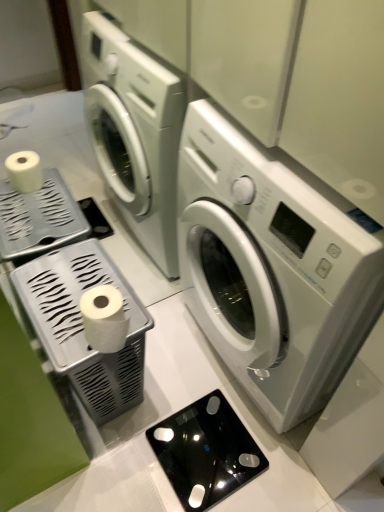
You are a GUI agent. You are given a task and a screenshot of the screen. Output one action in this format:
    pyautogui.click(x=<x>, y=<y>)
    Task: Click on the vacant area that is situated to the right of black glass scale at lower center, placed as the 2th appliance when sorted from left to right
    The width and height of the screenshot is (384, 512).
    Given the screenshot: What is the action you would take?
    pyautogui.click(x=281, y=461)